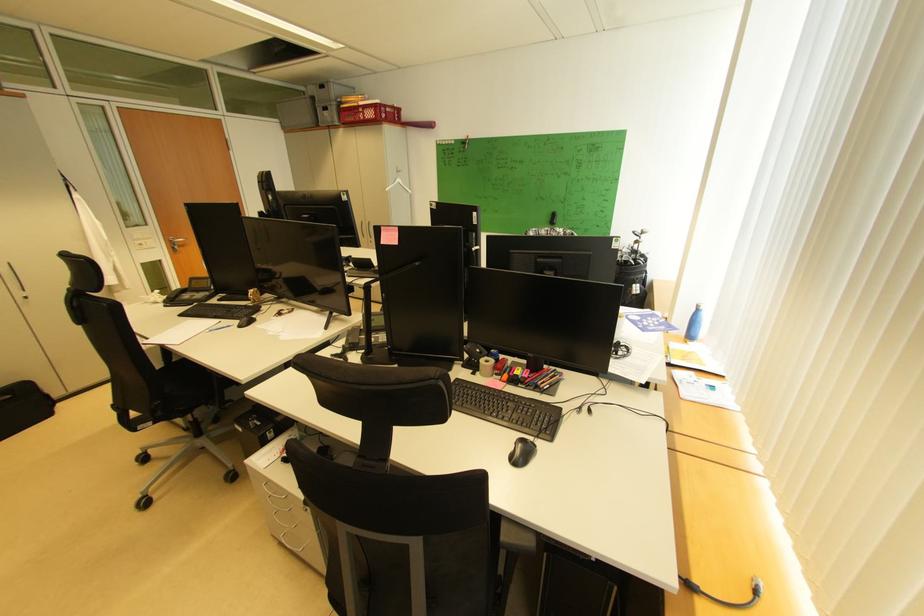
Where would you pull the silver door handle? Please return your answer as a coordinate pair (x, y).

(176, 240)